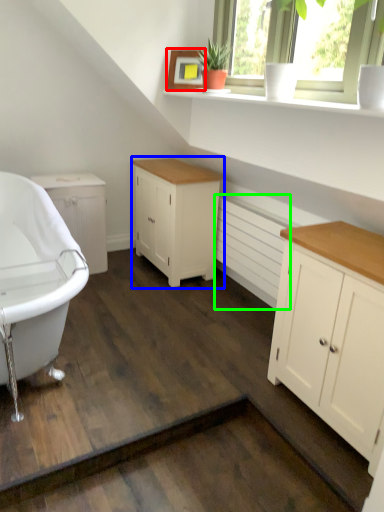
Question: Which is nearer to the picture frame (highlighted by a red box)? cabinetry (highlighted by a blue box) or radiator (highlighted by a green box).

Choices:
 (A) cabinetry
 (B) radiator

Answer: (A)